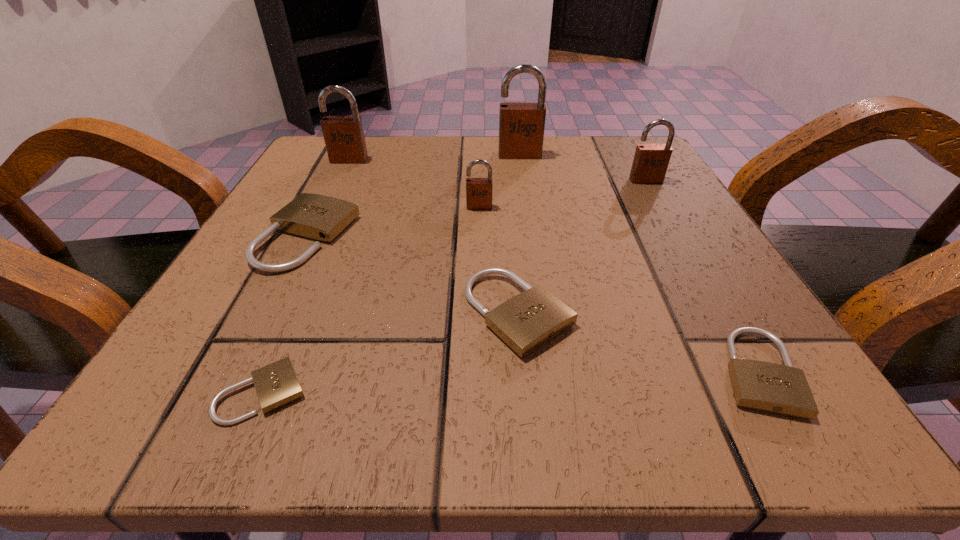
Identify the location of the biggest brown padlock. The height and width of the screenshot is (540, 960). (521, 124).

Where is `the tallest padlock`? This screenshot has height=540, width=960. the tallest padlock is located at coordinates (521, 124).

Where is `the seventh shortest padlock`? Image resolution: width=960 pixels, height=540 pixels. the seventh shortest padlock is located at coordinates (344, 138).

Identify the location of the leftmost brown padlock. (344, 138).

The image size is (960, 540). I want to click on the third farthest brown padlock, so click(650, 163).

Locate an element on the screen. This screenshot has height=540, width=960. the sixth nearest padlock is located at coordinates (650, 163).

Find the location of a particular element. The width and height of the screenshot is (960, 540). the fifth shortest padlock is located at coordinates (479, 191).

This screenshot has height=540, width=960. Identify the location of the second brown padlock from left to right. (479, 191).

You are a GUI agent. You are given a task and a screenshot of the screen. Output one action in this format:
    pyautogui.click(x=<x>, y=<y>)
    Task: Click on the biggest beige padlock
    The height and width of the screenshot is (540, 960).
    Given the screenshot: What is the action you would take?
    pyautogui.click(x=313, y=216)

Identify the location of the fifth tallest object. (313, 216).